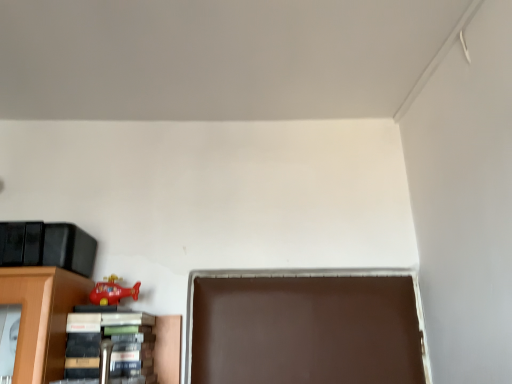
Question: Considering the positions of rubber red helicopter at lower left and hardcover book at lower left in the image, is rubber red helicopter at lower left wider or thinner than hardcover book at lower left?

Choices:
 (A) wide
 (B) thin

Answer: (B)

Question: Is rubber red helicopter at lower left to the left or to the right of hardcover book at lower left in the image?

Choices:
 (A) right
 (B) left

Answer: (B)

Question: From the image's perspective, is rubber red helicopter at lower left located above or below hardcover book at lower left?

Choices:
 (A) above
 (B) below

Answer: (A)

Question: In the image, is hardcover book at lower left on the left side or the right side of rubber red helicopter at lower left?

Choices:
 (A) left
 (B) right

Answer: (B)

Question: Considering the positions of hardcover book at lower left and rubber red helicopter at lower left in the image, is hardcover book at lower left taller or shorter than rubber red helicopter at lower left?

Choices:
 (A) short
 (B) tall

Answer: (B)

Question: Looking at the image, does hardcover book at lower left seem bigger or smaller compared to rubber red helicopter at lower left?

Choices:
 (A) small
 (B) big

Answer: (B)

Question: Looking at their shapes, would you say hardcover book at lower left is wider or thinner than rubber red helicopter at lower left?

Choices:
 (A) thin
 (B) wide

Answer: (B)